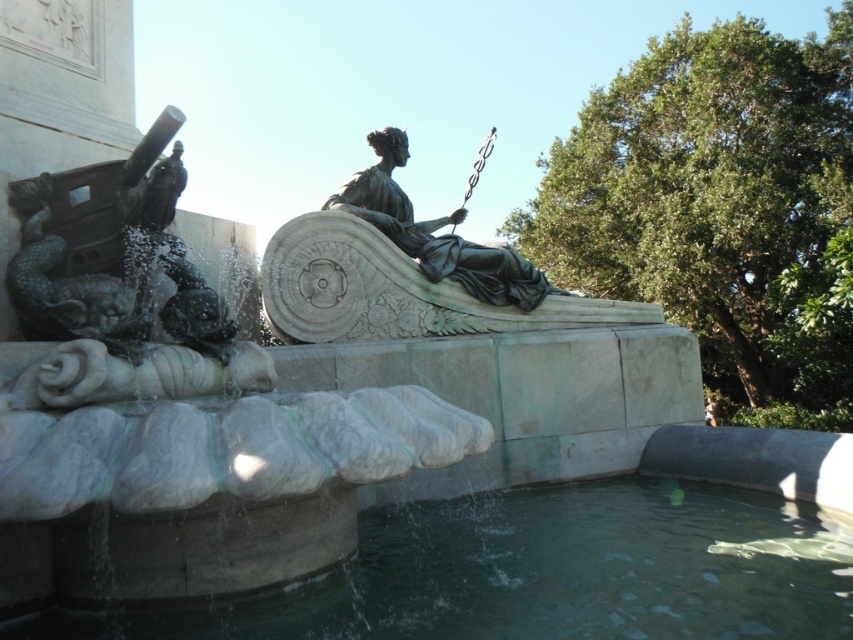
Question: Can you confirm if polished bronze cannon at left is wider than bronze statue at center?

Choices:
 (A) yes
 (B) no

Answer: (A)

Question: In this image, where is polished bronze cannon at left located relative to bronze statue at center?

Choices:
 (A) above
 (B) below

Answer: (B)

Question: Does clear water at lower center appear under polished bronze cannon at left?

Choices:
 (A) no
 (B) yes

Answer: (B)

Question: Which point is closer to the camera?

Choices:
 (A) clear water at lower center
 (B) bronze statue at center
 (C) polished bronze cannon at left

Answer: (A)

Question: Among these points, which one is farthest from the camera?

Choices:
 (A) (54, 212)
 (B) (637, 637)
 (C) (421, 260)

Answer: (C)

Question: Which is nearer to the clear water at lower center?

Choices:
 (A) bronze statue at center
 (B) polished bronze cannon at left

Answer: (B)